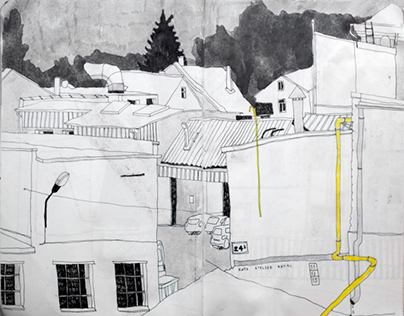
The height and width of the screenshot is (316, 404). I want to click on window panels, so click(61, 271), click(71, 270), click(72, 283), click(62, 283), click(63, 300), click(71, 300), click(84, 300).